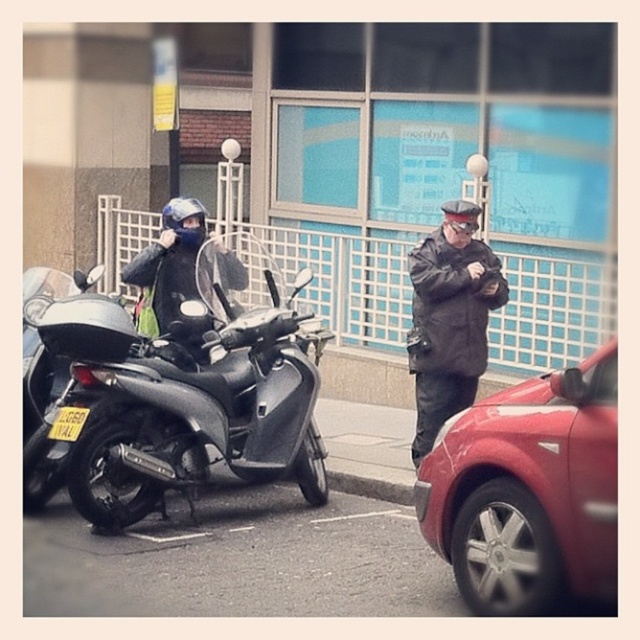
Does point (492, 477) come farther from viewer compared to point (472, 240)?

That is False.

Is point (586, 520) closer to viewer compared to point (435, 428)?

Yes, point (586, 520) is in front of point (435, 428).

Does point (486, 586) come farther from viewer compared to point (444, 339)?

That is False.

You are a GUI agent. You are given a task and a screenshot of the screen. Output one action in this format:
    pyautogui.click(x=<x>, y=<y>)
    Task: Click on the metallic red car at right
    The image size is (640, 640).
    Given the screenshot: What is the action you would take?
    pyautogui.click(x=529, y=492)

Does matte black scooter at left have a greater width compared to metallic red car at right?

Yes.

The image size is (640, 640). In order to click on matte black scooter at left in this screenshot , I will do `click(184, 394)`.

What do you see at coordinates (184, 394) in the screenshot? I see `matte black scooter at left` at bounding box center [184, 394].

Which is behind, point (99, 346) or point (472, 202)?

The point (472, 202) is behind.

Is point (323, 337) closer to camera compared to point (433, 348)?

Yes, point (323, 337) is in front of point (433, 348).

Where is `matte black scooter at left`? matte black scooter at left is located at coordinates (184, 394).